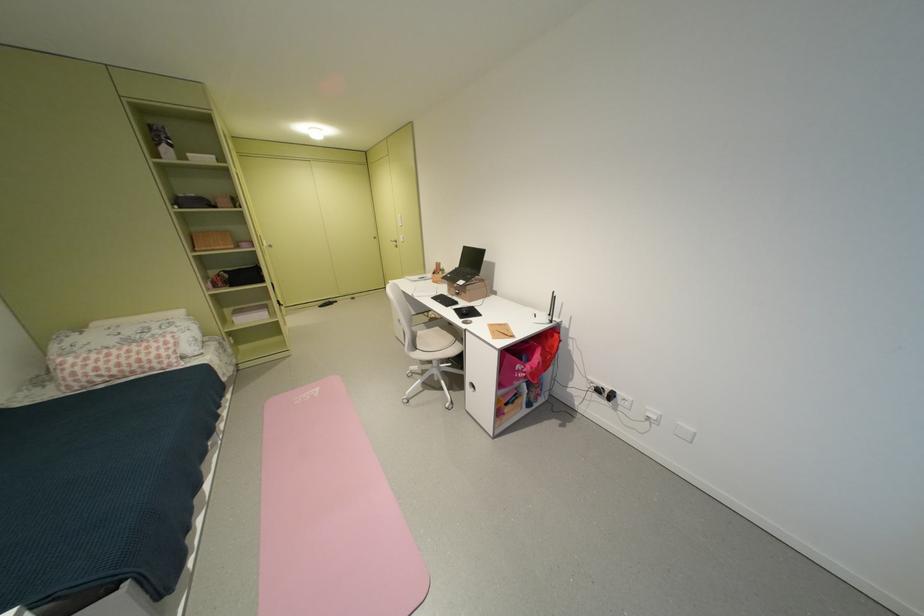
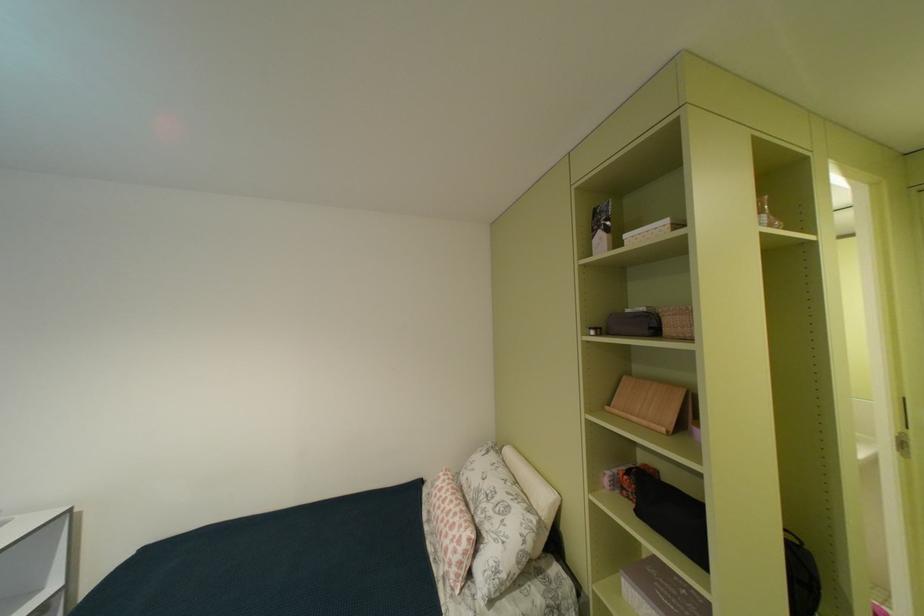
Question: I am providing you with two images of the same scene from different viewpoints. Please identify which objects are invisible in image2.

Choices:
 (A) white bolster pillow
 (B) pink patterned pillow
 (C) wooden book stand
 (D) none of these

Answer: (D)